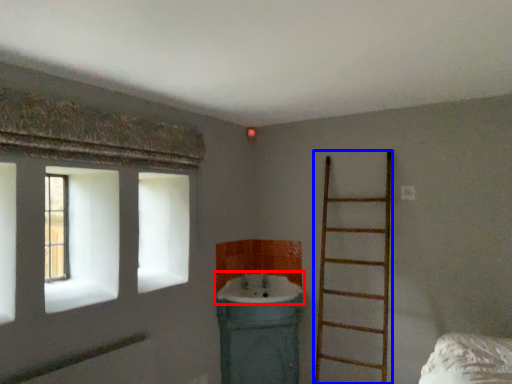
Question: Which object appears closest to the camera in this image, sink (highlighted by a red box) or ladder (highlighted by a blue box)?

Choices:
 (A) sink
 (B) ladder

Answer: (B)